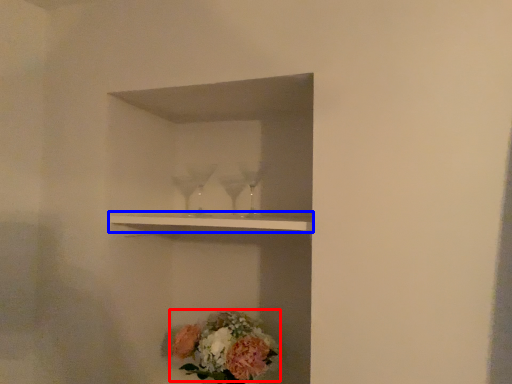
Question: Which of the following is the closest to the observer, flower (highlighted by a red box) or shelf (highlighted by a blue box)?

Choices:
 (A) flower
 (B) shelf

Answer: (B)